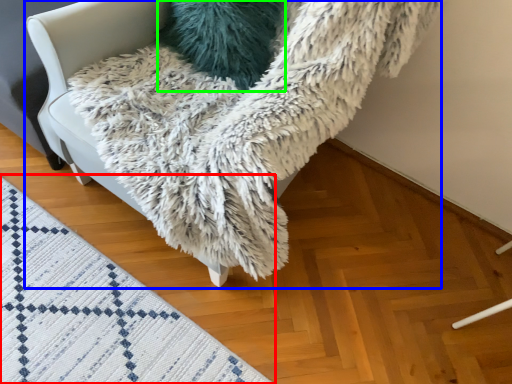
Question: Based on their relative distances, which object is nearer to mat (highlighted by a red box)? Choose from furniture (highlighted by a blue box) and pillow (highlighted by a green box).

Choices:
 (A) furniture
 (B) pillow

Answer: (A)